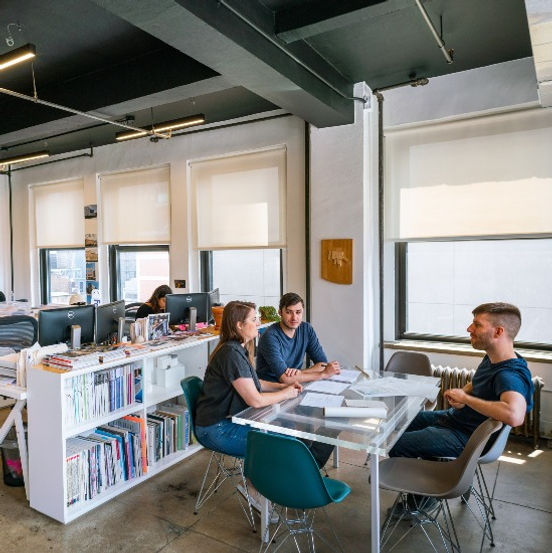
I want to click on grey chairs, so click(456, 474), click(498, 452), click(418, 366).